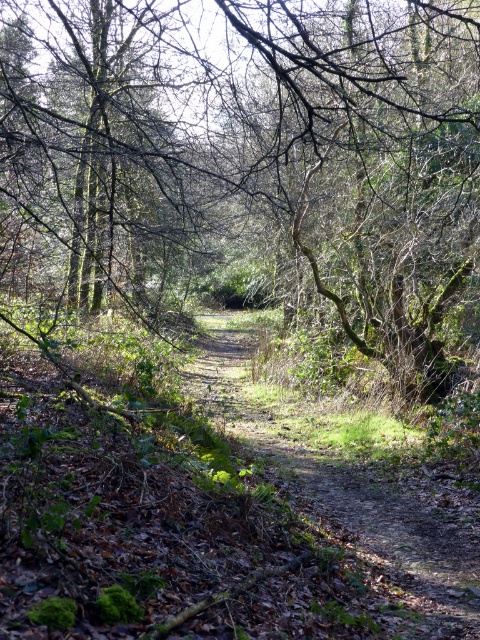
Is green mossy tree at center in front of dirt path at center?

Yes, it is.

Does green mossy tree at center have a smaller size compared to dirt path at center?

Incorrect, green mossy tree at center is not smaller in size than dirt path at center.

Measure the distance between point (x=330, y=64) and camera.

Point (x=330, y=64) is 4.36 meters from camera.

You are a GUI agent. You are given a task and a screenshot of the screen. Output one action in this format:
    pyautogui.click(x=<x>, y=<y>)
    Task: Click on the green mossy tree at center
    This screenshot has height=640, width=480.
    Given the screenshot: What is the action you would take?
    pyautogui.click(x=249, y=154)